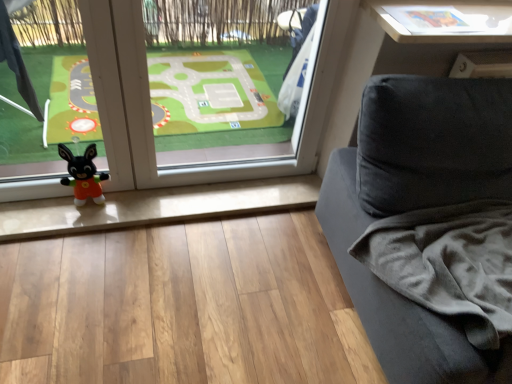
What do you see at coordinates (227, 79) in the screenshot?
I see `transparent glass window at center` at bounding box center [227, 79].

You are a GUI agent. You are given a task and a screenshot of the screen. Output one action in this format:
    pyautogui.click(x=<x>, y=<y>)
    Task: Click on the transparent glass window at center
    The width and height of the screenshot is (512, 384).
    Given the screenshot: What is the action you would take?
    pyautogui.click(x=227, y=79)

The width and height of the screenshot is (512, 384). What do you see at coordinates (444, 20) in the screenshot?
I see `white glossy table at upper right` at bounding box center [444, 20].

The image size is (512, 384). I want to click on white glossy table at upper right, so click(444, 20).

Locate an element on the screen. The height and width of the screenshot is (384, 512). transparent glass window at center is located at coordinates (227, 79).

Looking at this image, considering the relative positions of transparent glass window at center and white glossy table at upper right in the image provided, is transparent glass window at center to the left or to the right of white glossy table at upper right?

transparent glass window at center is positioned on white glossy table at upper right's left side.

Is transparent glass window at center in front of or behind white glossy table at upper right in the image?

transparent glass window at center is in front of white glossy table at upper right.

Does point (82, 83) appear closer or farther from the camera than point (443, 33)?

Point (82, 83).

From the image's perspective, relative to white glossy table at upper right, is transparent glass window at center above or below?

Clearly, from the image's perspective, transparent glass window at center is below white glossy table at upper right.

From a real-world perspective, which object stands above the other?

white glossy table at upper right is physically above.

In the scene shown: Is transparent glass window at center wider or thinner than white glossy table at upper right?

In the image, transparent glass window at center appears to be wider than white glossy table at upper right.

Is transparent glass window at center shorter than white glossy table at upper right?

In fact, transparent glass window at center may be taller than white glossy table at upper right.

Who is bigger, transparent glass window at center or white glossy table at upper right?

transparent glass window at center.

Is white glossy table at upper right surrounded by transparent glass window at center?

Definitely not — white glossy table at upper right is not inside transparent glass window at center.

Is transparent glass window at center next to white glossy table at upper right?

transparent glass window at center is not next to white glossy table at upper right, and they're not touching.

Could you tell me if transparent glass window at center is turned towards white glossy table at upper right?

No, transparent glass window at center is not aimed at white glossy table at upper right.

Locate an element on the screen. This screenshot has height=384, width=512. window on the left of white glossy table at upper right is located at coordinates (227, 79).

Which is more to the right, white glossy table at upper right or transparent glass window at center?

white glossy table at upper right is more to the right.

Considering the positions of objects white glossy table at upper right and transparent glass window at center in the image provided, who is behind, white glossy table at upper right or transparent glass window at center?

white glossy table at upper right is more distant.

Considering the positions of point (440, 23) and point (30, 64), is point (440, 23) closer or farther from the camera than point (30, 64)?

Point (440, 23) is positioned closer to the camera compared to point (30, 64).

From the image's perspective, relative to transparent glass window at center, is white glossy table at upper right above or below?

Based on their image positions, white glossy table at upper right is located above transparent glass window at center.

From a real-world perspective, which object rests below the other?

transparent glass window at center, from a real-world perspective.

Can you confirm if white glossy table at upper right is wider than transparent glass window at center?

No.

Does white glossy table at upper right have a greater height compared to transparent glass window at center?

Incorrect, the height of white glossy table at upper right is not larger of that of transparent glass window at center.

Can you confirm if white glossy table at upper right is bigger than transparent glass window at center?

Actually, white glossy table at upper right might be smaller than transparent glass window at center.

Is white glossy table at upper right situated inside transparent glass window at center or outside?

white glossy table at upper right lies outside transparent glass window at center.

Is white glossy table at upper right positioned far away from transparent glass window at center?

Indeed, white glossy table at upper right is not near transparent glass window at center.

Is white glossy table at upper right oriented towards transparent glass window at center?

No, white glossy table at upper right is not oriented towards transparent glass window at center.

How much distance is there between white glossy table at upper right and transparent glass window at center?

white glossy table at upper right is 3.46 feet from transparent glass window at center.

Where is `table behind the transparent glass window at center`? The width and height of the screenshot is (512, 384). table behind the transparent glass window at center is located at coordinates (444, 20).

At what (x,y) coordinates should I click in order to perform the action: click on table lying behind the transparent glass window at center. Please return your answer as a coordinate pair (x, y). Looking at the image, I should click on (444, 20).

Where is `window in front of the white glossy table at upper right`? window in front of the white glossy table at upper right is located at coordinates (227, 79).